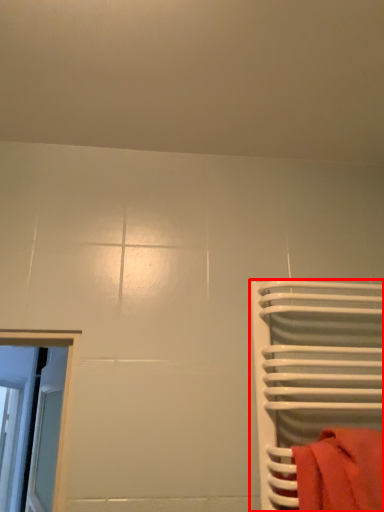
Question: In this image, where is furniture (annotated by the red box) located relative to towel?

Choices:
 (A) left
 (B) right

Answer: (B)